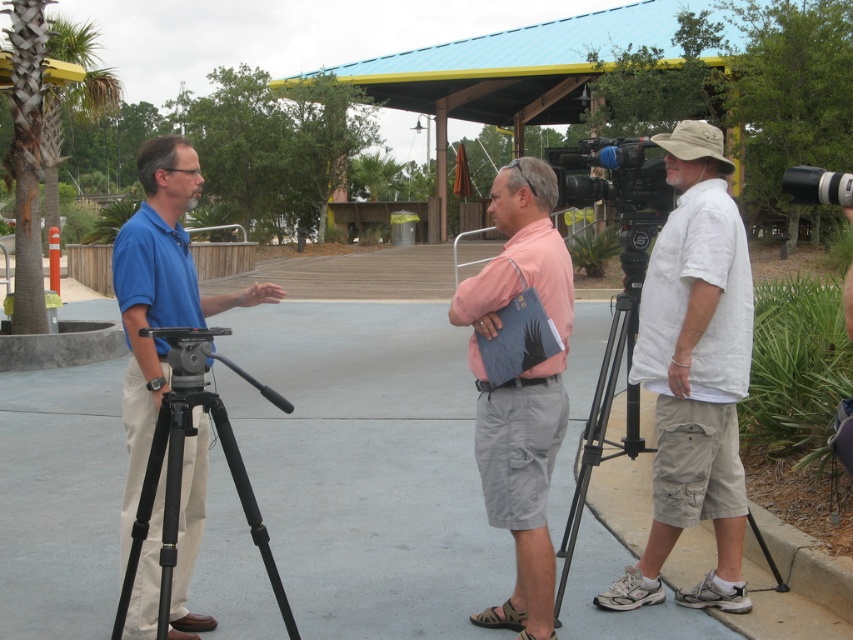
You are setting up equipment for a video shoot and need to choose a tripod that can reach a minimum height of 1.5 meters. Based on the scene, which tripod between the black matte tripod at left and the black metal tripod at right would you select?

The black metal tripod at right has a greater height than the black matte tripod at left, so you should choose the black metal tripod at right to meet the minimum height requirement of 1.5 meters.

You are a photographer standing at the center of the walkway. You need to position your camera exactly at the coordinates given in the description. Where should you place your camera relative to the black matte tripod at left?

The black matte tripod at left is already positioned at coordinates point (181,467), so you should place your camera at that exact point to match its location.